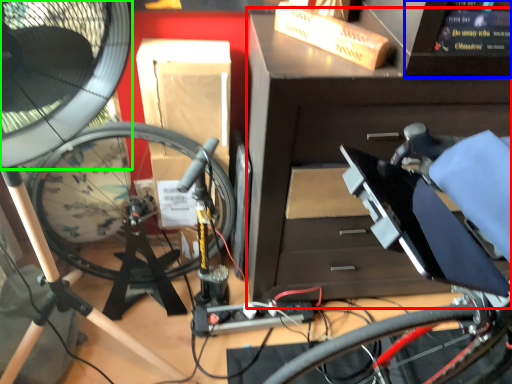
Question: Considering the real-world distances, which object is closest to workbench (highlighted by a red box)? computer screen (highlighted by a blue box) or mechanical fan (highlighted by a green box).

Choices:
 (A) computer screen
 (B) mechanical fan

Answer: (A)